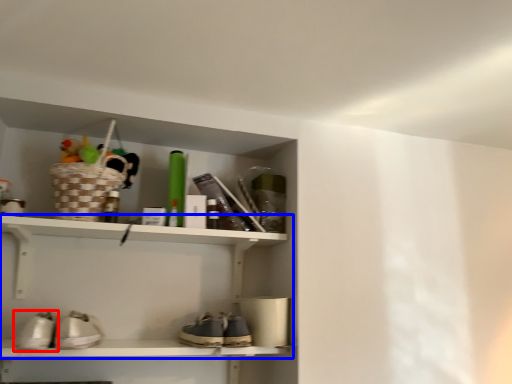
Question: Which object is further to the camera taking this photo, footwear (highlighted by a red box) or shelf (highlighted by a blue box)?

Choices:
 (A) footwear
 (B) shelf

Answer: (B)